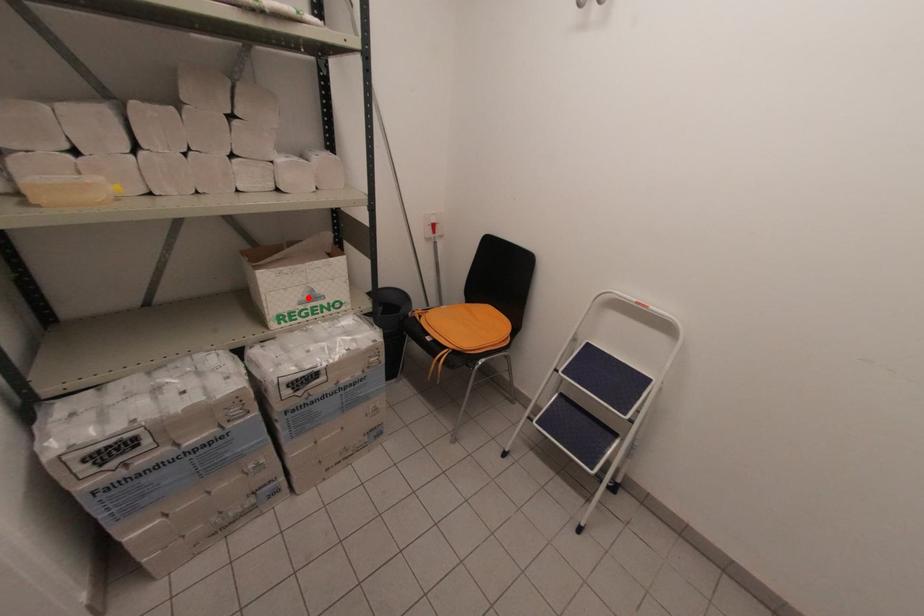
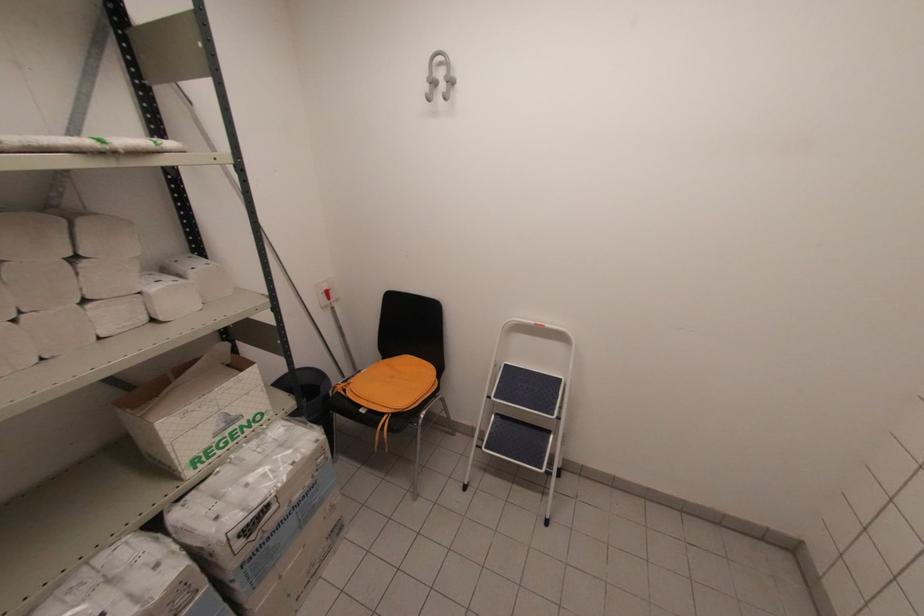
Locate, in the second image, the point that corresponds to the highlighted location in the first image.

(224, 426)